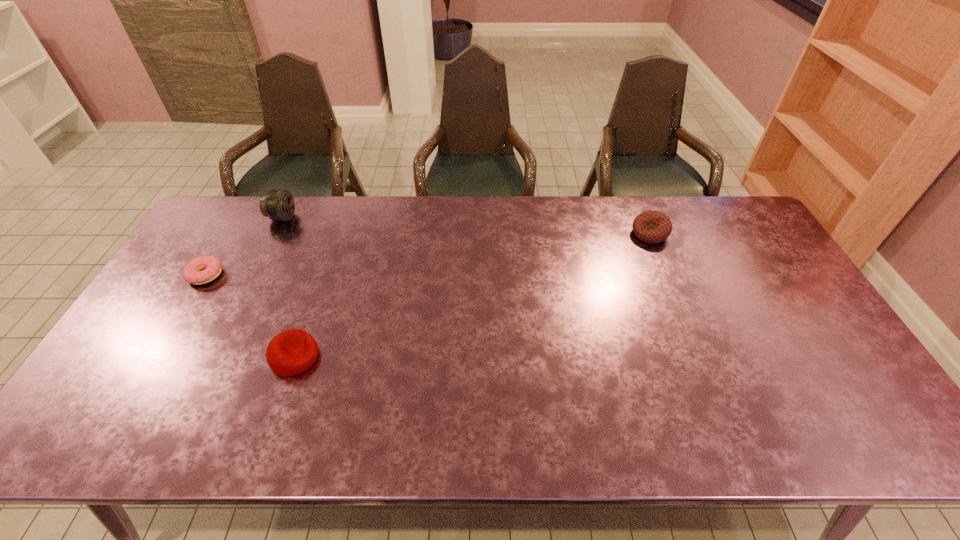
Find the location of a particular element. the tallest object is located at coordinates (278, 205).

You are a GUI agent. You are given a task and a screenshot of the screen. Output one action in this format:
    pyautogui.click(x=<x>, y=<y>)
    Task: Click on the telephoto lens
    This screenshot has width=960, height=540.
    Given the screenshot: What is the action you would take?
    pyautogui.click(x=278, y=205)

Where is `the rightmost object`? This screenshot has height=540, width=960. the rightmost object is located at coordinates (652, 227).

Locate an element on the screen. The height and width of the screenshot is (540, 960). the farther beanbag is located at coordinates (652, 227).

This screenshot has height=540, width=960. What are the coordinates of `the left beanbag` in the screenshot? It's located at (293, 351).

Identify the location of the nearer beanbag. The image size is (960, 540). (293, 351).

Image resolution: width=960 pixels, height=540 pixels. What are the coordinates of `the leftmost object` in the screenshot? It's located at (212, 266).

Locate an element on the screen. The width and height of the screenshot is (960, 540). the shortest object is located at coordinates [x=212, y=266].

Identify the location of free location located on the front-facing side of the telephoto lens. (384, 218).

Identify the location of free region located 0.160m on the right of the farther beanbag. This screenshot has height=540, width=960. (715, 234).